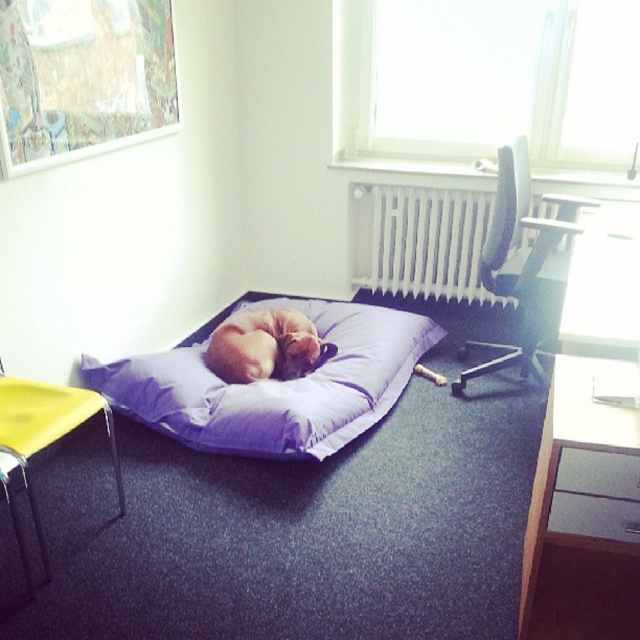
Between yellow fabric chair at lower left and soft beige cat at center, which one has less height?

soft beige cat at center

How much distance is there between yellow fabric chair at lower left and soft beige cat at center?

They are 35.22 inches apart.

Does point (44, 422) come behind point (240, 355)?

No, it is not.

This screenshot has width=640, height=640. What are the coordinates of `yellow fabric chair at lower left` in the screenshot? It's located at (48, 432).

Is white glossy computer desk at upper right below white metallic radiator at upper center?

Indeed, white glossy computer desk at upper right is positioned under white metallic radiator at upper center.

Can you confirm if white glossy computer desk at upper right is smaller than white metallic radiator at upper center?

Actually, white glossy computer desk at upper right might be larger than white metallic radiator at upper center.

This screenshot has height=640, width=640. What do you see at coordinates (588, 451) in the screenshot? I see `white glossy computer desk at upper right` at bounding box center [588, 451].

Locate an element on the screen. white glossy computer desk at upper right is located at coordinates (588, 451).

Can you confirm if white glossy computer desk at upper right is smaller than yellow fabric chair at lower left?

Actually, white glossy computer desk at upper right might be larger than yellow fabric chair at lower left.

Does white glossy computer desk at upper right have a lesser width compared to yellow fabric chair at lower left?

No.

Which is in front, point (579, 240) or point (56, 412)?

Positioned in front is point (56, 412).

Where is `white glossy computer desk at upper right`? This screenshot has width=640, height=640. white glossy computer desk at upper right is located at coordinates (588, 451).